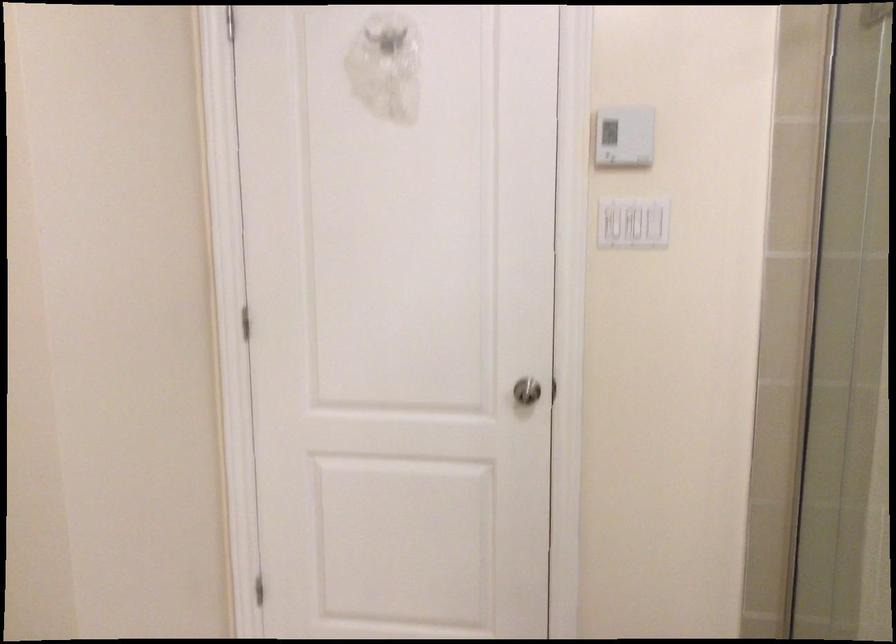
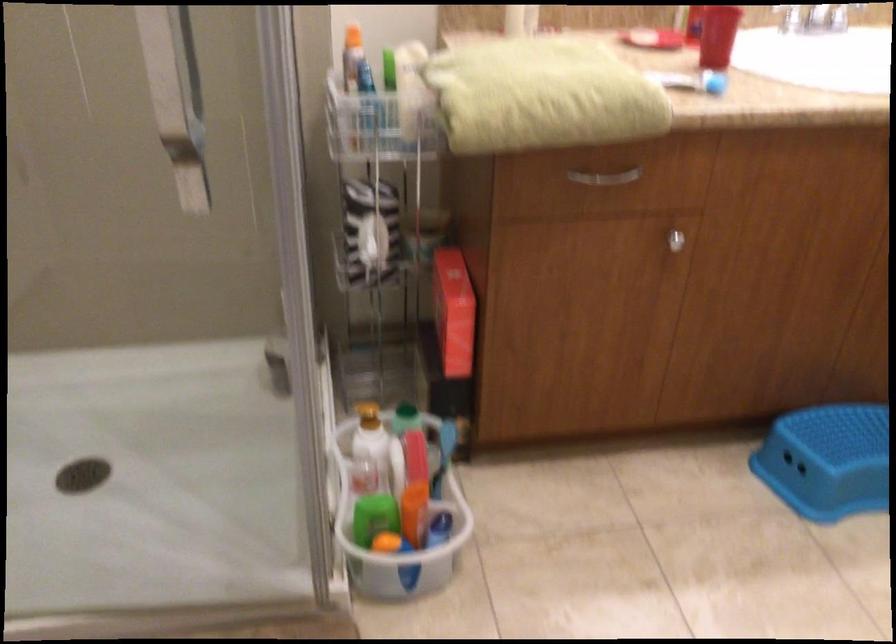
From the picture: The images are taken continuously from a first-person perspective. In which direction is your viewpoint rotating?

The rotation direction of the camera is right-down.